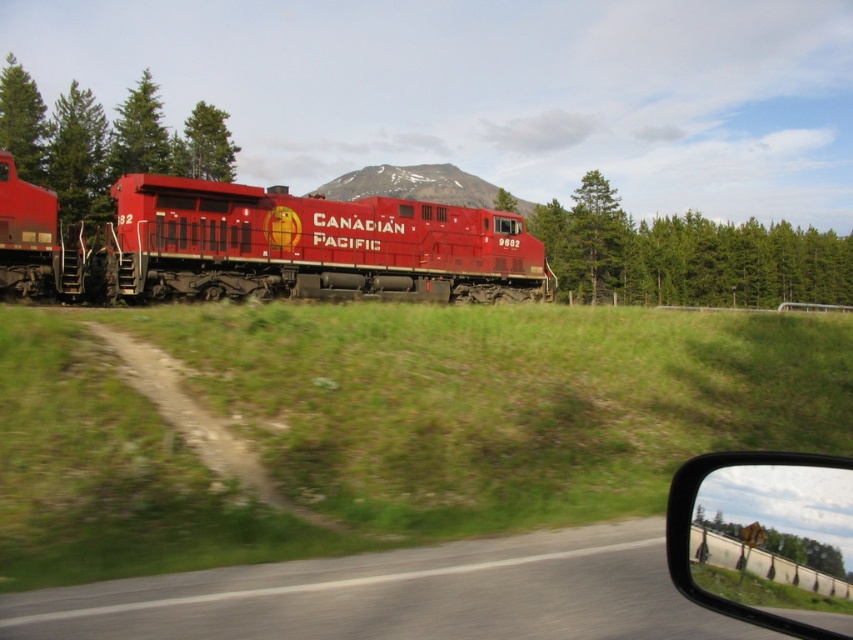
Question: In this image, where is green leafy tree at left located relative to transparent glass car window at center?

Choices:
 (A) above
 (B) below

Answer: (A)

Question: Is matte red locomotive at center to the left of transparent glass car window at center from the viewer's perspective?

Choices:
 (A) no
 (B) yes

Answer: (B)

Question: Does matte red locomotive at center have a larger size compared to green leafy trees at center?

Choices:
 (A) yes
 (B) no

Answer: (B)

Question: Which point is farther to the camera?

Choices:
 (A) snowy mountain at upper center
 (B) matte red locomotive at center

Answer: (A)

Question: Among these points, which one is farthest from the camera?

Choices:
 (A) (770, 468)
 (B) (398, 173)

Answer: (B)

Question: Among these points, which one is farthest from the camera?

Choices:
 (A) (28, 177)
 (B) (727, 502)
 (C) (190, 132)

Answer: (C)